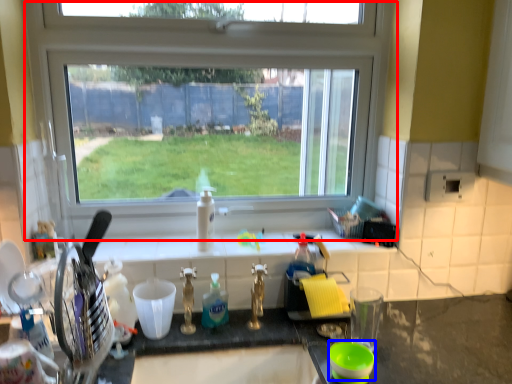
Question: Which point is further to the camera, window (highlighted by a red box) or basin (highlighted by a blue box)?

Choices:
 (A) window
 (B) basin

Answer: (A)